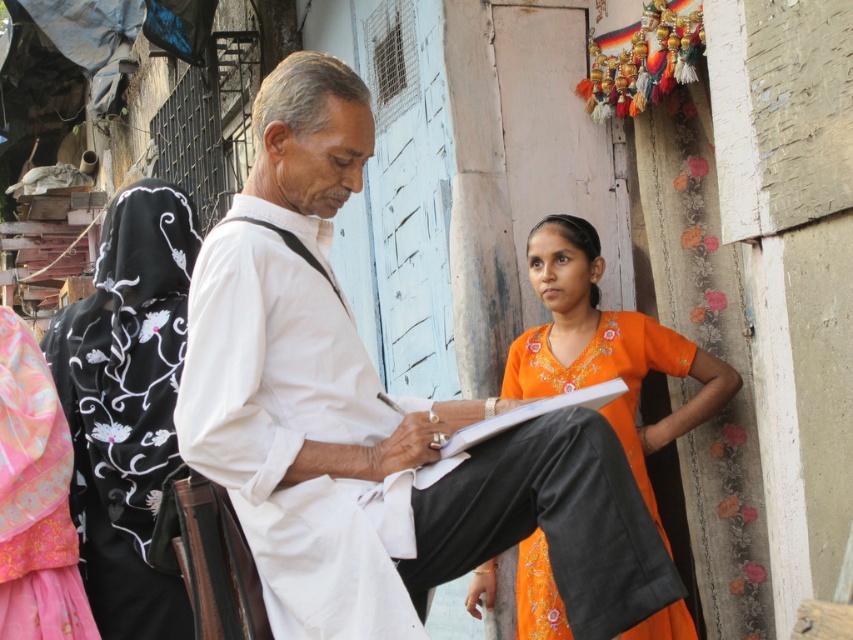
You are a photographer trying to capture a detailed shot of the black embroidered scarf at left without moving the camera. Can you estimate if the scarf is within the camera focus range of 5 meters?

The black embroidered scarf at left is 4.57 meters away from the camera, which is within the 5 meter focus range. Therefore, the scarf can be captured in focus without moving the camera.

In the scene described, there is a white cotton shirt at center and a white paper clipboard at center. From the perspective of someone facing the scene, which object is positioned to the left?

The white cotton shirt at center is to the left of the white paper clipboard at center.

Based on the scene described, where is the white cotton shirt at center located in terms of coordinates?

The white cotton shirt at center is located at coordinates point (x=375, y=419).